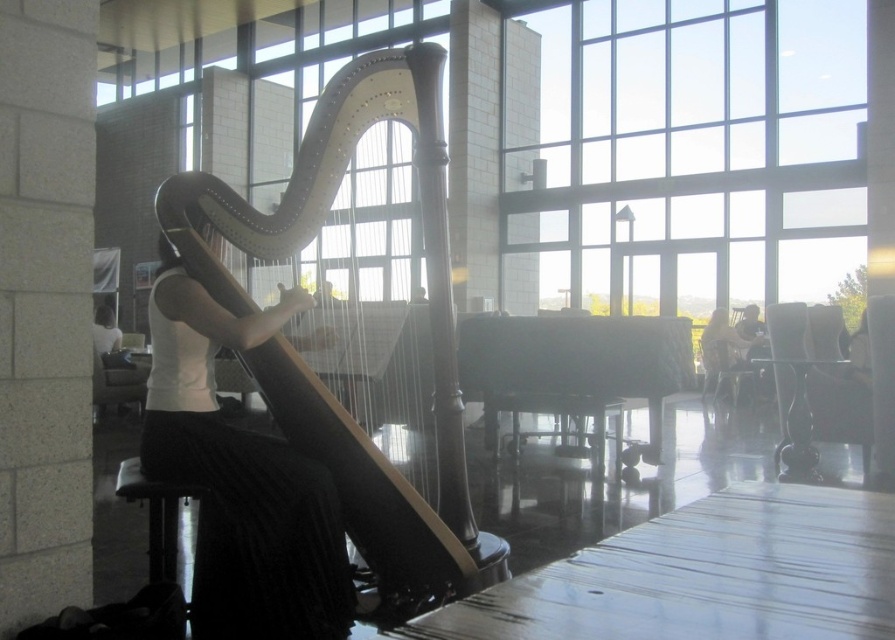
Question: Is black leather stool at lower left to the left of matte white dress at center from the viewer's perspective?

Choices:
 (A) yes
 (B) no

Answer: (A)

Question: Which point is closer to the camera?

Choices:
 (A) matte black harpist at center
 (B) polished dark wood harp at center
 (C) black leather stool at lower left
 (D) transparent glass window at upper center

Answer: (C)

Question: Which of the following is the closest to the observer?

Choices:
 (A) matte black harpist at center
 (B) polished dark wood harp at center

Answer: (A)

Question: Estimate the real-world distances between objects in this image. Which object is closer to the black leather stool at lower left?

Choices:
 (A) matte white dress at center
 (B) matte black harpist at center
 (C) transparent glass window at upper center

Answer: (B)

Question: Is transparent glass window at upper center to the left of black leather stool at lower left from the viewer's perspective?

Choices:
 (A) no
 (B) yes

Answer: (A)

Question: Where is matte black harpist at center located in relation to matte white dress at center in the image?

Choices:
 (A) right
 (B) left

Answer: (B)